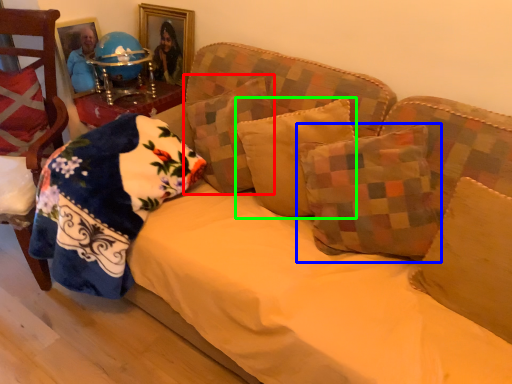
Question: Estimate the real-world distances between objects in this image. Which object is farther from pillow (highlighted by a red box), pillow (highlighted by a blue box) or pillow (highlighted by a green box)?

Choices:
 (A) pillow
 (B) pillow

Answer: (A)